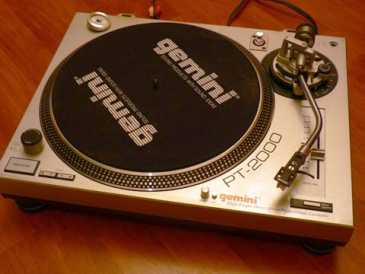
Identify the location of turntable. (173, 121).